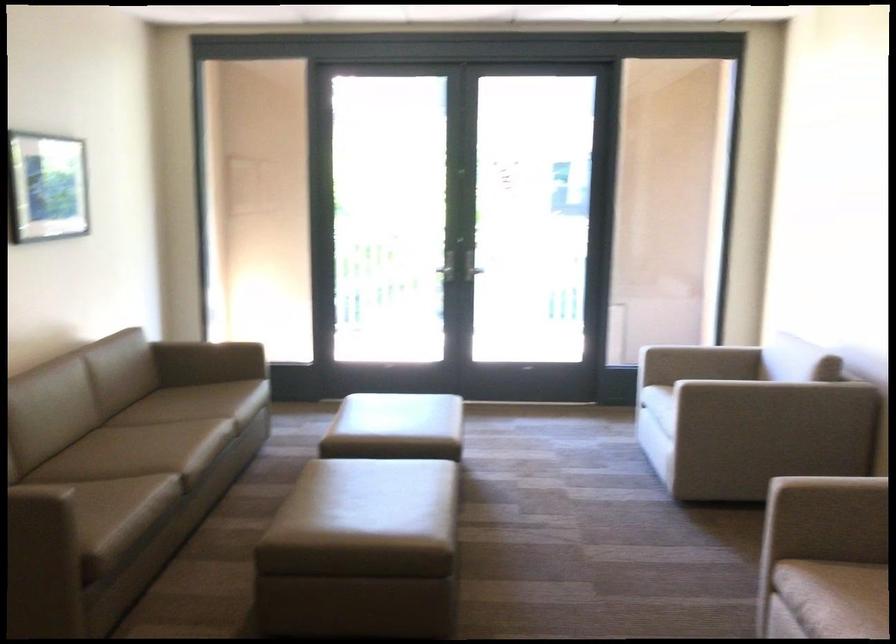
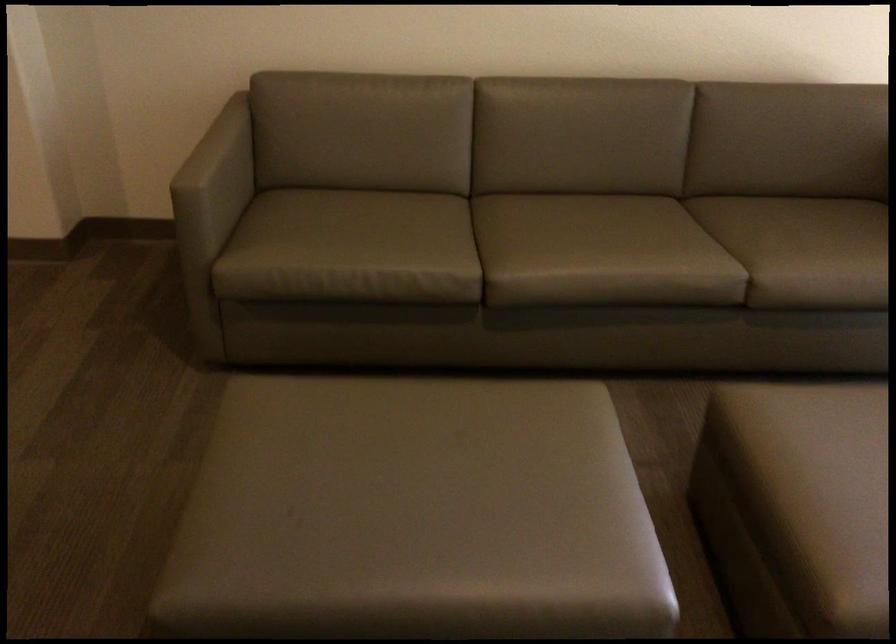
Where in the second image is the point corresponding to point 357,500 from the first image?

(407, 480)